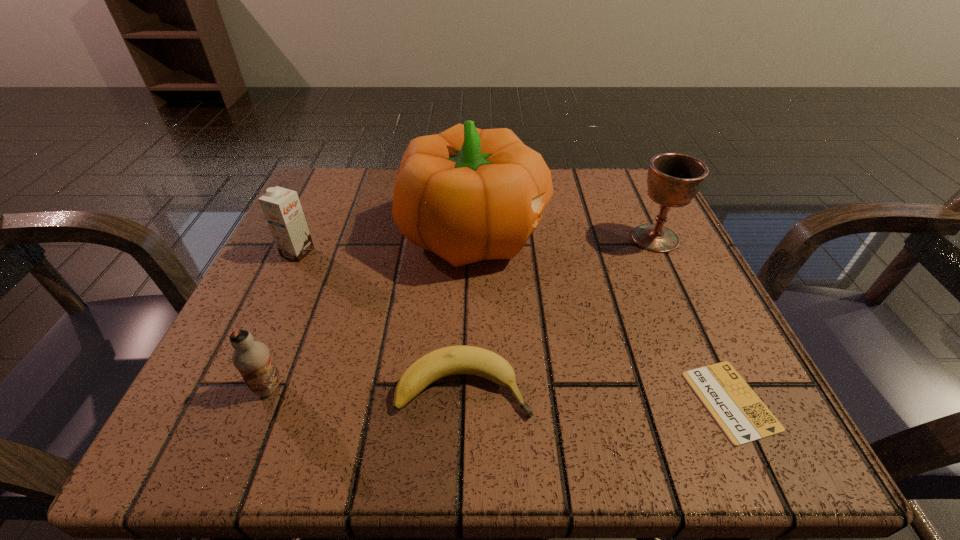
Identify the location of vacant space in between the farther chocolate milk and the fifth tallest object. This screenshot has height=540, width=960. (380, 320).

This screenshot has height=540, width=960. What are the coordinates of `unoccupied area between the nearer chocolate milk and the chalice` in the screenshot? It's located at (462, 313).

Where is `empty space that is in between the banana and the identity card`? empty space that is in between the banana and the identity card is located at coordinates (597, 394).

Where is `free space between the fifth shortest object and the pumpkin`? This screenshot has width=960, height=540. free space between the fifth shortest object and the pumpkin is located at coordinates (565, 235).

Identify the location of vacant area that lies between the nearer chocolate milk and the pumpkin. (372, 310).

Locate an element on the screen. The image size is (960, 540). free space between the tallest object and the identity card is located at coordinates 603,317.

Locate an element on the screen. The width and height of the screenshot is (960, 540). free space between the second tallest object and the tallest object is located at coordinates (565, 235).

Image resolution: width=960 pixels, height=540 pixels. Find the location of `free space between the identity card and the chalice`. free space between the identity card and the chalice is located at coordinates (693, 320).

Locate an element on the screen. object that stands as the closest to the farther chocolate milk is located at coordinates (466, 194).

Image resolution: width=960 pixels, height=540 pixels. I want to click on object identified as the third closest to the identity card, so click(673, 180).